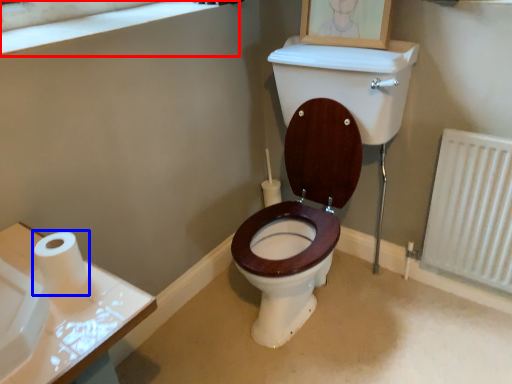
Question: Which object appears farthest to the camera in this image, window frame (highlighted by a red box) or toilet paper (highlighted by a blue box)?

Choices:
 (A) window frame
 (B) toilet paper

Answer: (A)